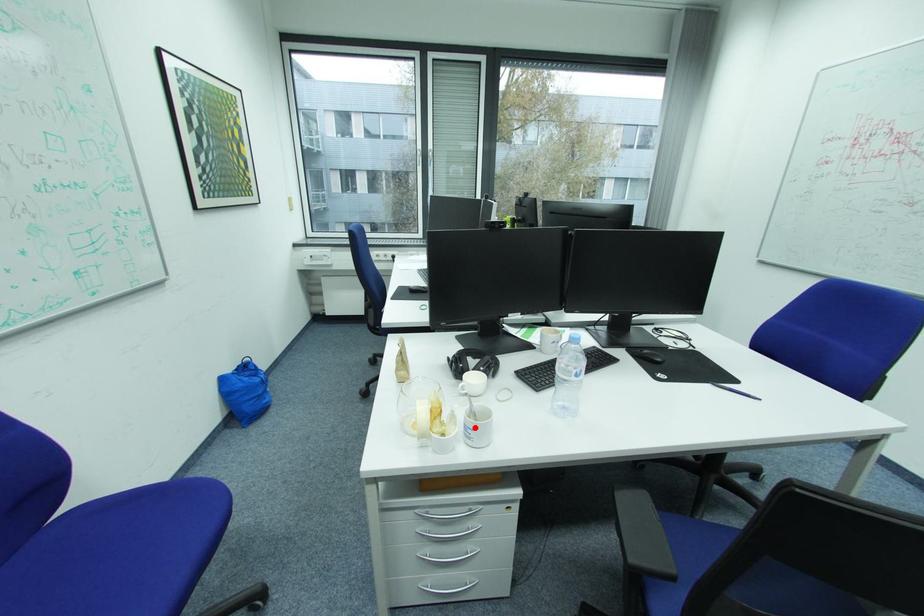
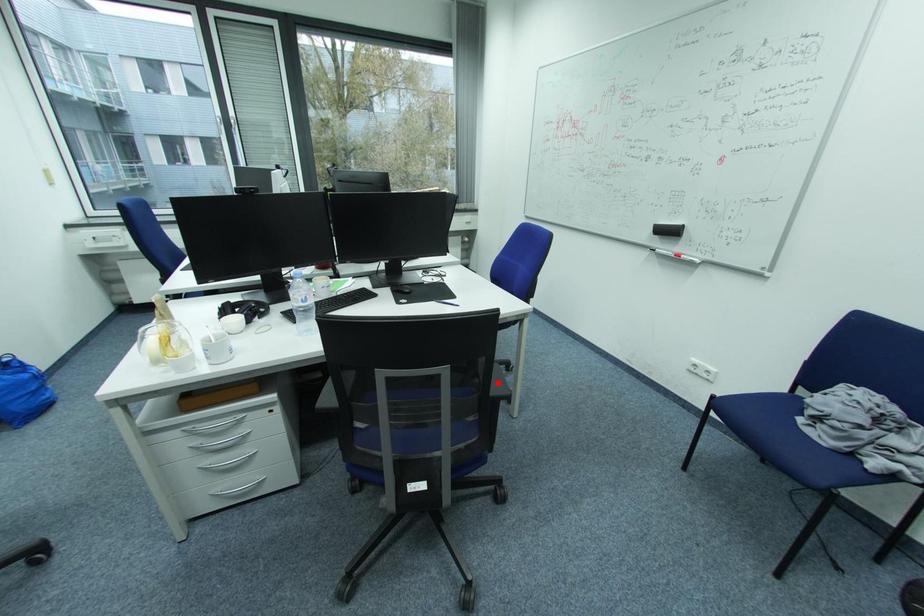
I am providing you with two images of the same scene from different viewpoints. A red point is marked on the first image and another point is marked on the second image. Are the points marked in image1 and image2 representing the same 3D position?

No